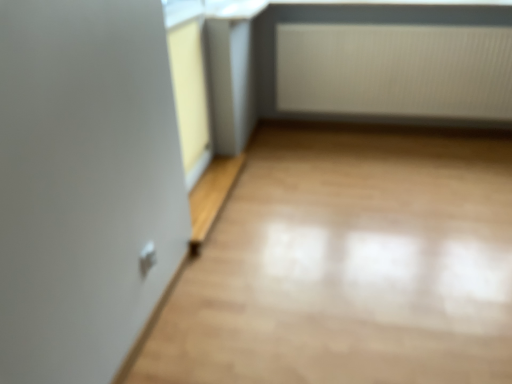
This screenshot has height=384, width=512. Find the location of `yellow matte window frame at upper left`. yellow matte window frame at upper left is located at coordinates (189, 84).

What do you see at coordinates (189, 84) in the screenshot? The width and height of the screenshot is (512, 384). I see `yellow matte window frame at upper left` at bounding box center [189, 84].

Describe the element at coordinates (395, 70) in the screenshot. Image resolution: width=512 pixels, height=384 pixels. I see `white textured radiator at upper right` at that location.

At what (x,y) coordinates should I click in order to perform the action: click on white textured radiator at upper right. Please return your answer as a coordinate pair (x, y). This screenshot has width=512, height=384. Looking at the image, I should click on (395, 70).

Where is `yellow matte window frame at upper left`? yellow matte window frame at upper left is located at coordinates (189, 84).

Considering the relative positions of yellow matte window frame at upper left and white textured radiator at upper right in the image provided, is yellow matte window frame at upper left to the left or to the right of white textured radiator at upper right?

In the image, yellow matte window frame at upper left appears on the left side of white textured radiator at upper right.

Considering the positions of objects yellow matte window frame at upper left and white textured radiator at upper right in the image provided, who is behind, yellow matte window frame at upper left or white textured radiator at upper right?

Positioned behind is white textured radiator at upper right.

Between point (187, 79) and point (489, 58), which one is positioned in front?

The point (187, 79) is closer to the camera.

From the image's perspective, between yellow matte window frame at upper left and white textured radiator at upper right, which one is located above?

white textured radiator at upper right, from the image's perspective.

From a real-world perspective, which is physically above, yellow matte window frame at upper left or white textured radiator at upper right?

yellow matte window frame at upper left.

Is yellow matte window frame at upper left wider or thinner than white textured radiator at upper right?

yellow matte window frame at upper left is thinner than white textured radiator at upper right.

Is yellow matte window frame at upper left taller than white textured radiator at upper right?

Correct, yellow matte window frame at upper left is much taller as white textured radiator at upper right.

Consider the image. Between yellow matte window frame at upper left and white textured radiator at upper right, which one has larger size?

With larger size is white textured radiator at upper right.

Which is correct: yellow matte window frame at upper left is inside white textured radiator at upper right, or outside of it?

The correct answer is: outside.

Are yellow matte window frame at upper left and white textured radiator at upper right beside each other?

No, yellow matte window frame at upper left is not making contact with white textured radiator at upper right.

Is yellow matte window frame at upper left turned away from white textured radiator at upper right?

yellow matte window frame at upper left does not have its back to white textured radiator at upper right.

How different are the orientations of yellow matte window frame at upper left and white textured radiator at upper right in degrees?

The facing directions of yellow matte window frame at upper left and white textured radiator at upper right are 89 degrees apart.

Image resolution: width=512 pixels, height=384 pixels. What are the coordinates of `radiator behind the yellow matte window frame at upper left` in the screenshot? It's located at (395, 70).

Consider the image. Would you say white textured radiator at upper right is to the left or to the right of yellow matte window frame at upper left in the picture?

white textured radiator at upper right is positioned on yellow matte window frame at upper left's right side.

Looking at this image, which is in front, white textured radiator at upper right or yellow matte window frame at upper left?

yellow matte window frame at upper left.

Which is closer, (295, 60) or (186, 106)?

Point (295, 60) appears to be farther away from the viewer than point (186, 106).

In the scene shown: From the image's perspective, is white textured radiator at upper right positioned above or below yellow matte window frame at upper left?

From the image's perspective, white textured radiator at upper right appears above yellow matte window frame at upper left.

From a real-world perspective, between white textured radiator at upper right and yellow matte window frame at upper left, who is vertically higher?

yellow matte window frame at upper left is physically above.

Is white textured radiator at upper right thinner than yellow matte window frame at upper left?

No.

Who is shorter, white textured radiator at upper right or yellow matte window frame at upper left?

With less height is white textured radiator at upper right.

Can you confirm if white textured radiator at upper right is bigger than yellow matte window frame at upper left?

Correct, white textured radiator at upper right is larger in size than yellow matte window frame at upper left.

Is white textured radiator at upper right positioned beyond the bounds of yellow matte window frame at upper left?

→ Yes, white textured radiator at upper right is outside of yellow matte window frame at upper left.

Is white textured radiator at upper right not close to yellow matte window frame at upper left?

white textured radiator at upper right is far away from yellow matte window frame at upper left.

Is white textured radiator at upper right facing towards yellow matte window frame at upper left?

Yes, white textured radiator at upper right is aimed at yellow matte window frame at upper left.

What's the angular difference between white textured radiator at upper right and yellow matte window frame at upper left's facing directions?

white textured radiator at upper right and yellow matte window frame at upper left are facing 89 degrees away from each other.

How distant is white textured radiator at upper right from yellow matte window frame at upper left?

They are 1.20 meters apart.

Locate an element on the screen. window frame on the left of white textured radiator at upper right is located at coordinates (189, 84).

Locate an element on the screen. The image size is (512, 384). radiator lying behind the yellow matte window frame at upper left is located at coordinates (395, 70).

The width and height of the screenshot is (512, 384). Find the location of `window frame on the left of white textured radiator at upper right`. window frame on the left of white textured radiator at upper right is located at coordinates (189, 84).